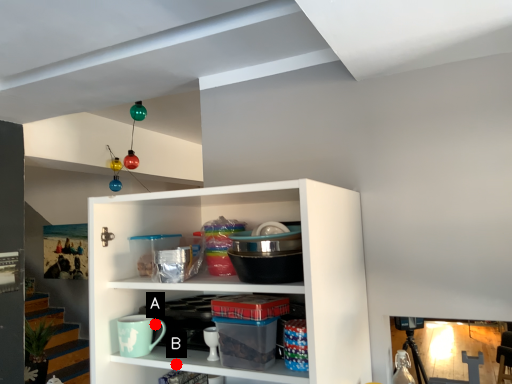
Question: Two points are circled on the image, labeled by A and B beside each circle. Which point is closer to the camera?

Choices:
 (A) A is closer
 (B) B is closer

Answer: (B)